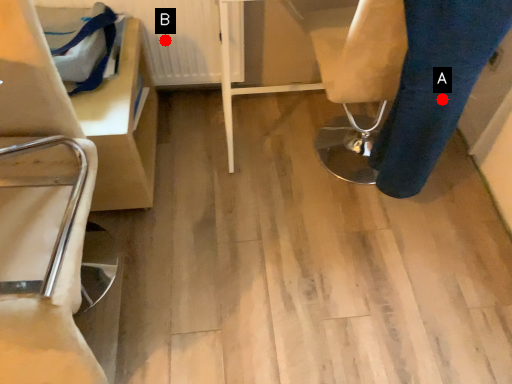
Question: Two points are circled on the image, labeled by A and B beside each circle. Among these points, which one is nearest to the camera?

Choices:
 (A) A is closer
 (B) B is closer

Answer: (A)